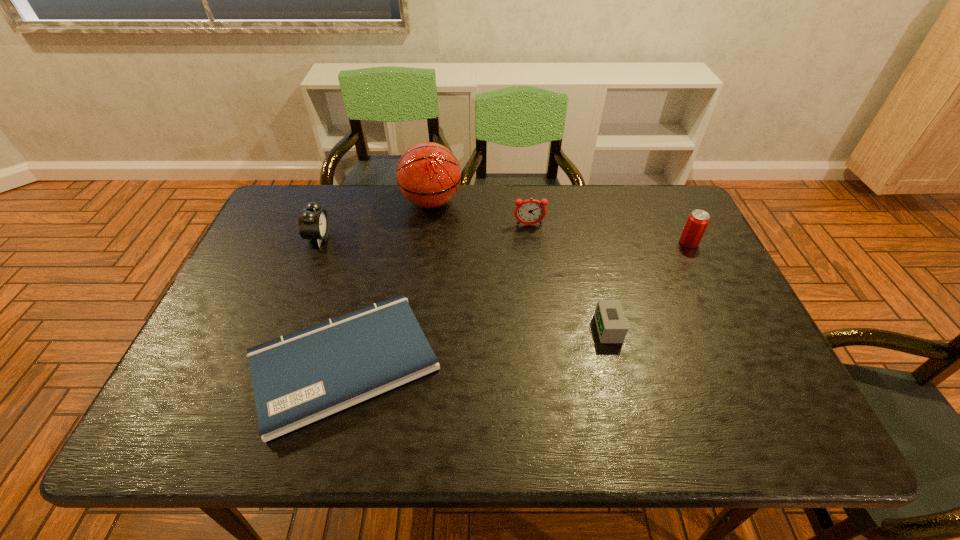
Where is `object situated at the right edge`? object situated at the right edge is located at coordinates (697, 222).

Find the location of `object that is at the far left corner`. object that is at the far left corner is located at coordinates (313, 223).

Where is `object that is at the near left corner`? object that is at the near left corner is located at coordinates (302, 377).

This screenshot has width=960, height=540. I want to click on vacant region at the far edge of the desktop, so click(554, 197).

In order to click on vacant space at the near edge of the desktop in this screenshot , I will do `click(420, 410)`.

The height and width of the screenshot is (540, 960). In order to click on free space at the left edge in this screenshot , I will do `click(194, 379)`.

Locate an element on the screen. The width and height of the screenshot is (960, 540). vacant space at the right edge of the desktop is located at coordinates (757, 391).

You are a GUI agent. You are given a task and a screenshot of the screen. Output one action in this format:
    pyautogui.click(x=<x>, y=<y>)
    Task: Click on the vacant space at the far left corner
    
    Given the screenshot: What is the action you would take?
    pyautogui.click(x=297, y=221)

This screenshot has height=540, width=960. I want to click on free spot between the shortest object and the second alarm clock from left to right, so click(437, 294).

This screenshot has width=960, height=540. What are the coordinates of `free point between the leftmost alarm clock and the can` in the screenshot? It's located at (504, 240).